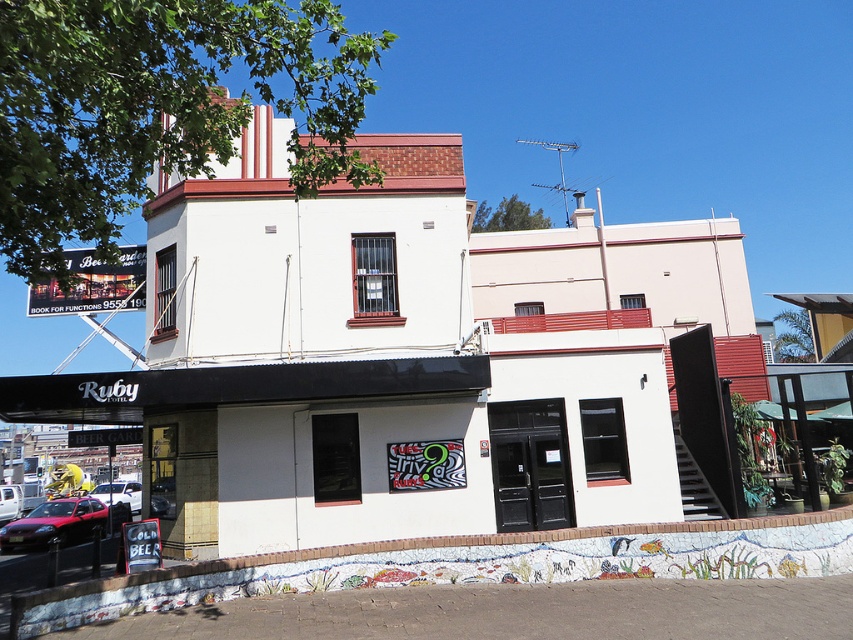
Can you confirm if matte red car at lower left is smaller than metallic red car at center?

Yes.

Does matte red car at lower left have a lesser width compared to metallic red car at center?

Yes.

Locate an element on the screen. This screenshot has height=640, width=853. matte red car at lower left is located at coordinates (55, 524).